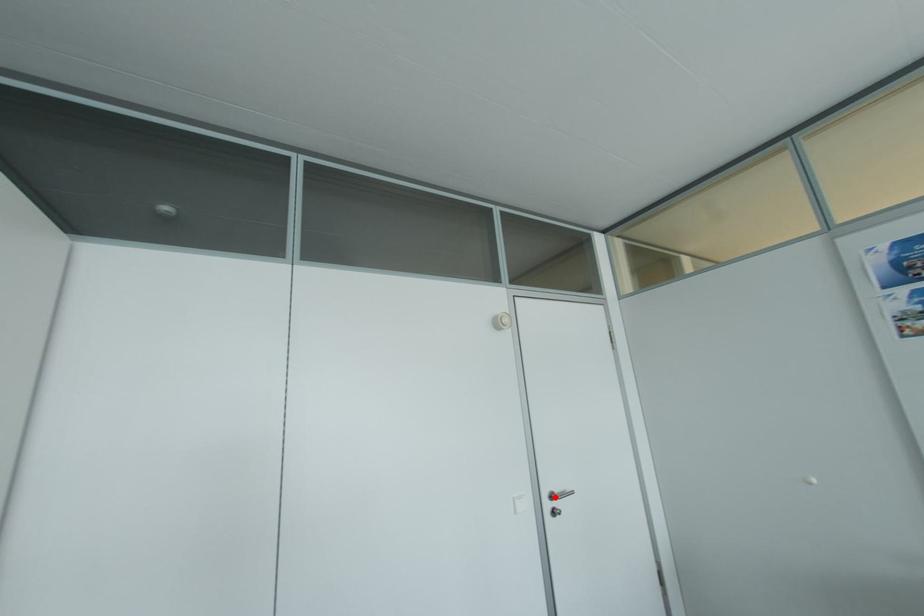
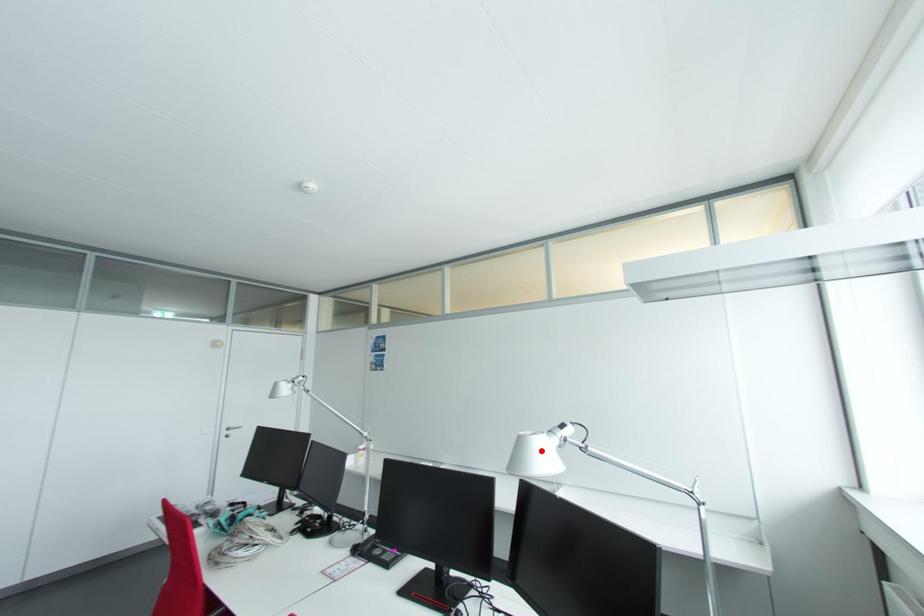
I am providing you with two images of the same scene from different viewpoints. A red point is marked on the first image and another point is marked on the second image. Is the marked point in image1 the same physical position as the marked point in image2?

No